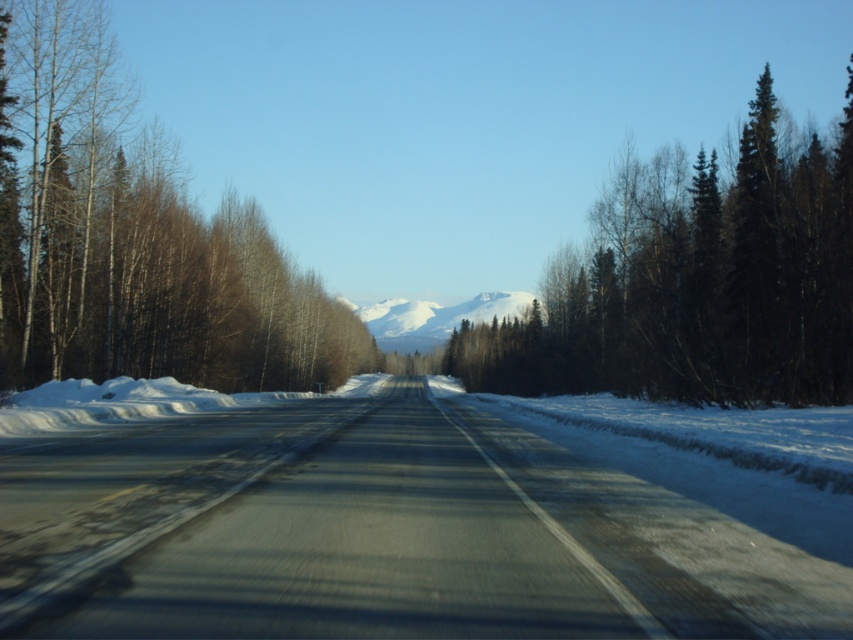
Question: Among these objects, which one is nearest to the camera?

Choices:
 (A) brown bark trees at left
 (B) snowy white mountain at center
 (C) smooth asphalt road at center
 (D) dark green textured evergreen tree at right

Answer: (C)

Question: Can you confirm if smooth asphalt road at center is positioned below brown bark trees at left?

Choices:
 (A) no
 (B) yes

Answer: (B)

Question: Is smooth asphalt road at center smaller than dark green textured evergreen tree at right?

Choices:
 (A) no
 (B) yes

Answer: (B)

Question: Among these objects, which one is nearest to the camera?

Choices:
 (A) snowy white mountain at center
 (B) dark green textured evergreen tree at right
 (C) smooth asphalt road at center
 (D) brown bark trees at left

Answer: (C)

Question: Does brown bark trees at left have a smaller size compared to snowy white mountain at center?

Choices:
 (A) yes
 (B) no

Answer: (A)

Question: Which of these objects is positioned closest to the brown bark trees at left?

Choices:
 (A) snowy white mountain at center
 (B) smooth asphalt road at center

Answer: (B)